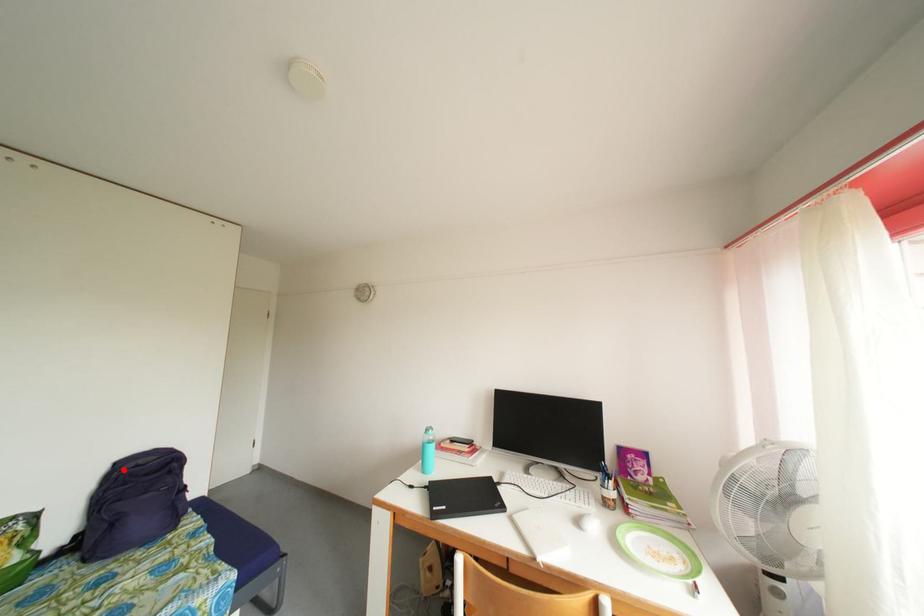
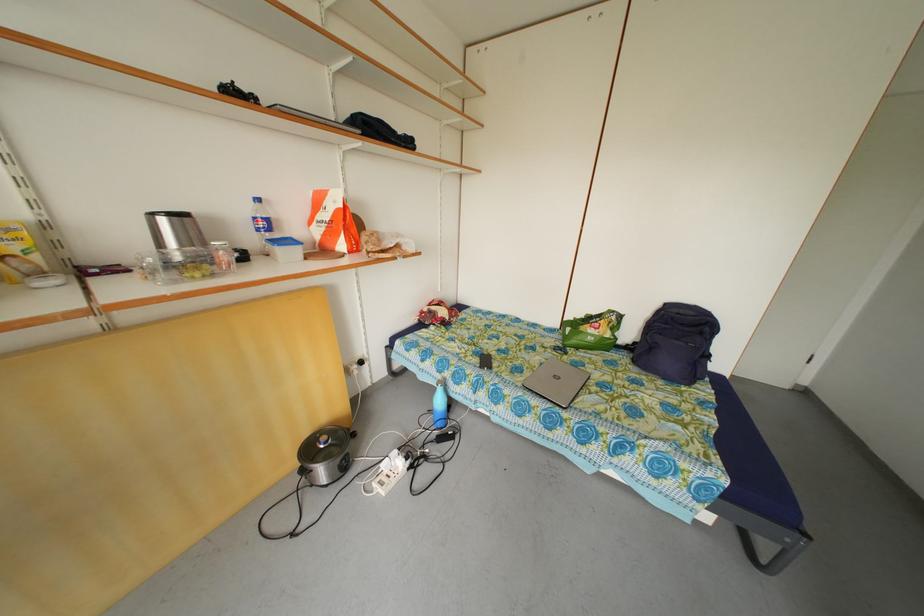
Question: I am providing you with two images of the same scene from different viewpoints. Given a red point in image1, look at the same physical point in image2. Is it:

Choices:
 (A) Closer to the viewpoint
 (B) Farther from the viewpoint

Answer: (B)